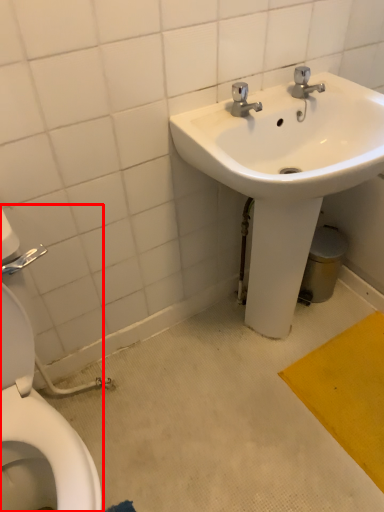
Question: From the image's perspective, where is toilet (annotated by the red box) located relative to sink?

Choices:
 (A) above
 (B) below

Answer: (B)